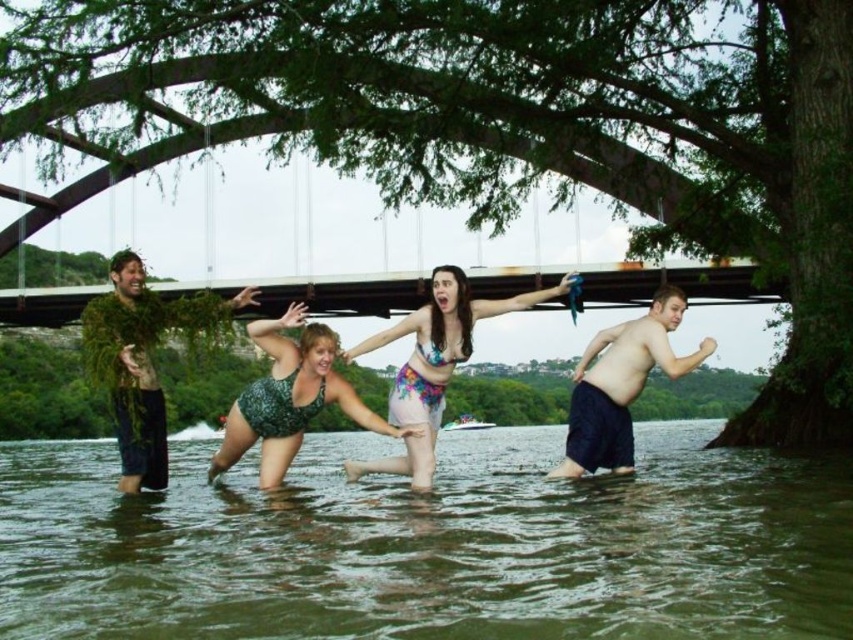
Is point (36, 320) positioned in front of point (260, 477)?

That is False.

Can you confirm if rusty metal bridge at center is positioned to the left of green textured swimsuit at center?

No, rusty metal bridge at center is not to the left of green textured swimsuit at center.

From the picture: Who is more distant from viewer, (363, 275) or (288, 438)?

Positioned behind is point (363, 275).

Find the location of `rusty metal bridge at center`. rusty metal bridge at center is located at coordinates (321, 292).

Can you confirm if green leafy tree at center is positioned above rusty metal bridge at center?

Yes.

Does green leafy tree at center have a lesser width compared to rusty metal bridge at center?

Correct, green leafy tree at center's width is less than rusty metal bridge at center's.

Measure the distance between point (61, 17) and camera.

The distance of point (61, 17) from camera is 66.03 meters.

The height and width of the screenshot is (640, 853). What are the coordinates of `green leafy tree at center` in the screenshot? It's located at (503, 125).

Is greenish murky water at lower center further to camera compared to green leafy plant at left?

No, it is in front of green leafy plant at left.

Between greenish murky water at lower center and green leafy plant at left, which one appears on the left side from the viewer's perspective?

From the viewer's perspective, green leafy plant at left appears more on the left side.

Does point (250, 566) come closer to viewer compared to point (142, 346)?

Yes, it is.

I want to click on greenish murky water at lower center, so click(x=428, y=544).